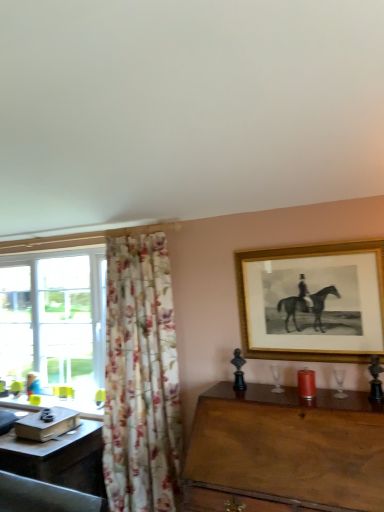
Question: Should I look upward or downward to see wooden desk at lower left?

Choices:
 (A) up
 (B) down

Answer: (B)

Question: Considering the relative sizes of wooden desk at lower left and matte black book at left in the image provided, is wooden desk at lower left thinner than matte black book at left?

Choices:
 (A) no
 (B) yes

Answer: (A)

Question: From the image's perspective, is wooden desk at lower left on matte black book at left?

Choices:
 (A) yes
 (B) no

Answer: (B)

Question: Is there a large distance between wooden desk at lower left and matte black book at left?

Choices:
 (A) no
 (B) yes

Answer: (A)

Question: Considering the relative positions of wooden desk at lower left and matte black book at left in the image provided, is wooden desk at lower left to the left of matte black book at left from the viewer's perspective?

Choices:
 (A) yes
 (B) no

Answer: (A)

Question: Is wooden desk at lower left shorter than matte black book at left?

Choices:
 (A) no
 (B) yes

Answer: (A)

Question: Is wooden desk at lower left looking in the opposite direction of matte black book at left?

Choices:
 (A) yes
 (B) no

Answer: (B)

Question: Is blue fabric person at lower left aimed at matte black book at left?

Choices:
 (A) no
 (B) yes

Answer: (A)

Question: Can you confirm if blue fabric person at lower left is bigger than matte black book at left?

Choices:
 (A) yes
 (B) no

Answer: (B)

Question: Is matte black book at left inside blue fabric person at lower left?

Choices:
 (A) no
 (B) yes

Answer: (A)

Question: Is blue fabric person at lower left outside matte black book at left?

Choices:
 (A) no
 (B) yes

Answer: (B)

Question: Would you say blue fabric person at lower left is a long distance from matte black book at left?

Choices:
 (A) no
 (B) yes

Answer: (A)

Question: Is matte black book at left at the back of blue fabric person at lower left?

Choices:
 (A) yes
 (B) no

Answer: (B)

Question: Are blue fabric person at lower left and floral fabric curtain at left far apart?

Choices:
 (A) no
 (B) yes

Answer: (B)